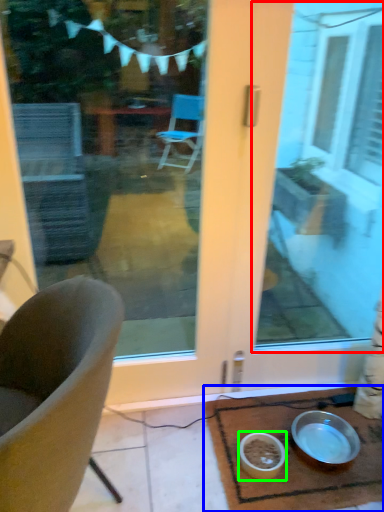
Question: Estimate the real-world distances between objects in this image. Which object is closer to window screen (highlighted by a red box), table (highlighted by a blue box) or bowl (highlighted by a green box)?

Choices:
 (A) table
 (B) bowl

Answer: (A)